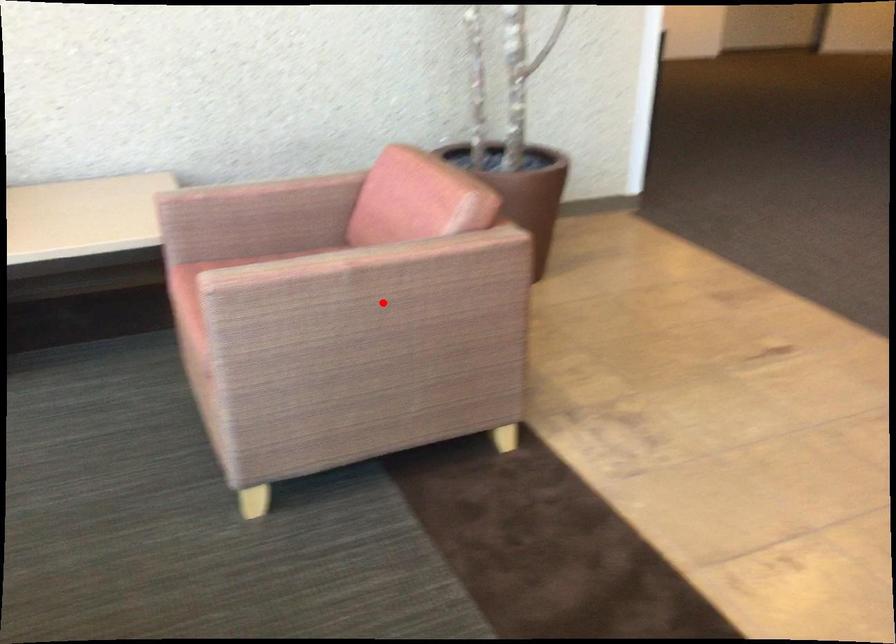
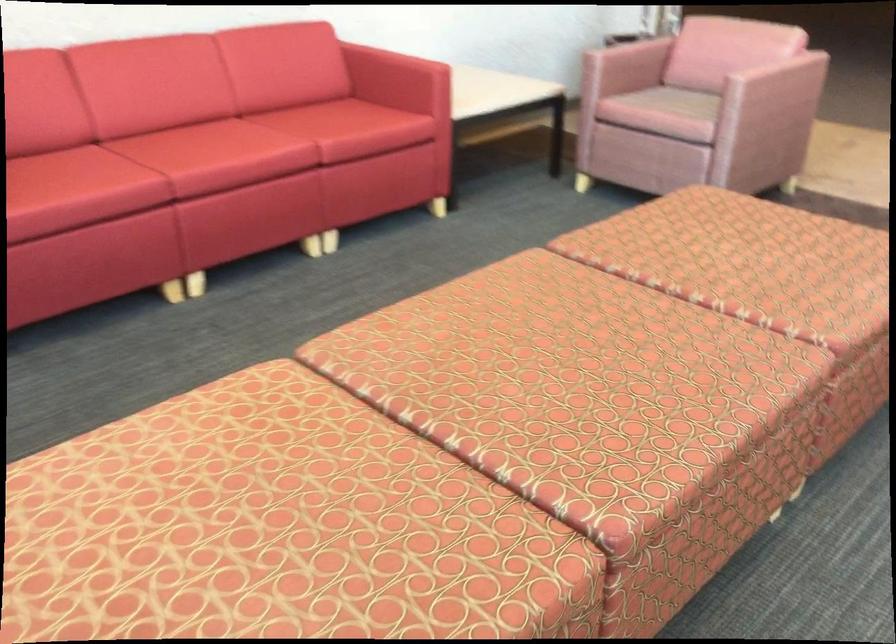
In the second image, find the point that corresponds to the highlighted location in the first image.

(773, 90)